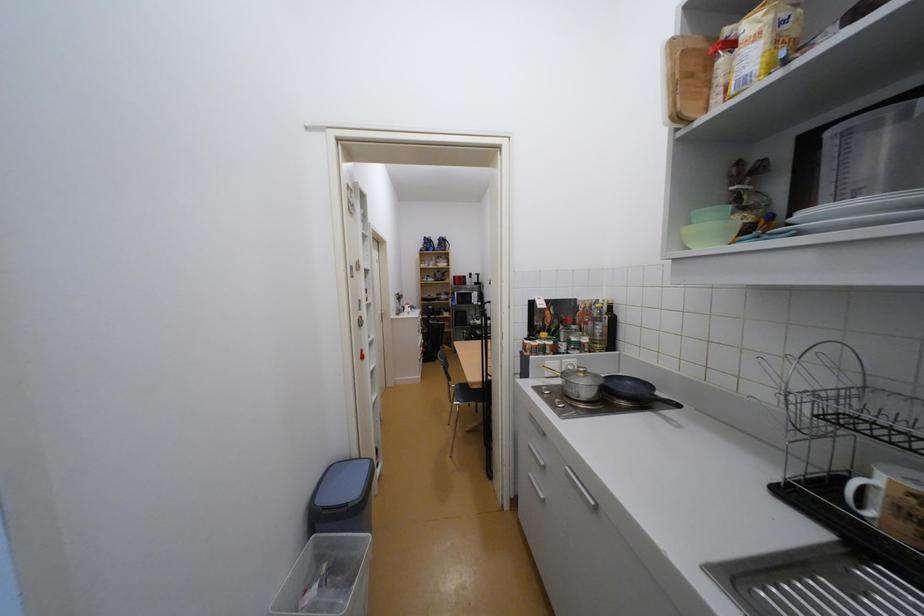
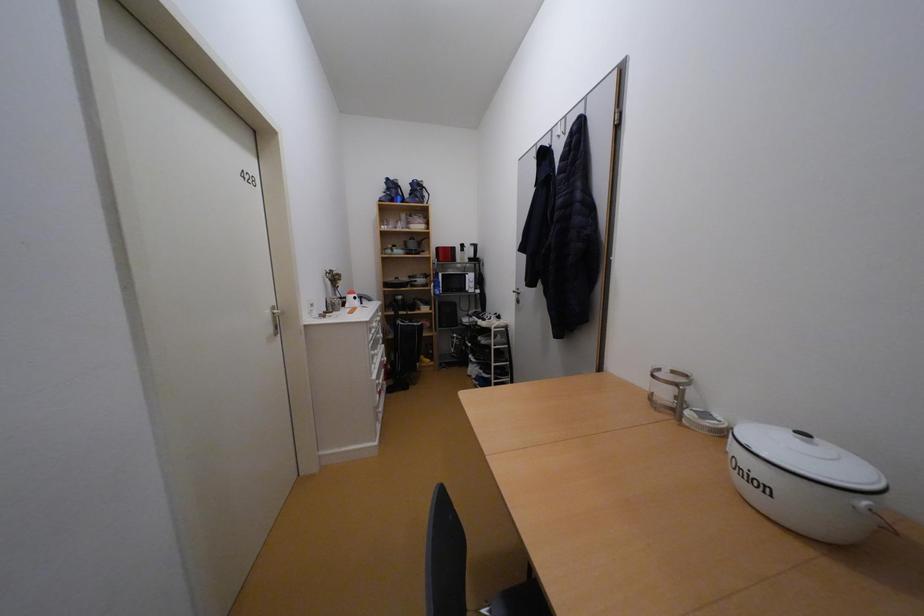
Question: Which direction would the cameraman need to move to produce the second image? Reply with the corresponding letter.

Choices:
 (A) Left
 (B) Right
 (C) Forward
 (D) Backward

Answer: (C)